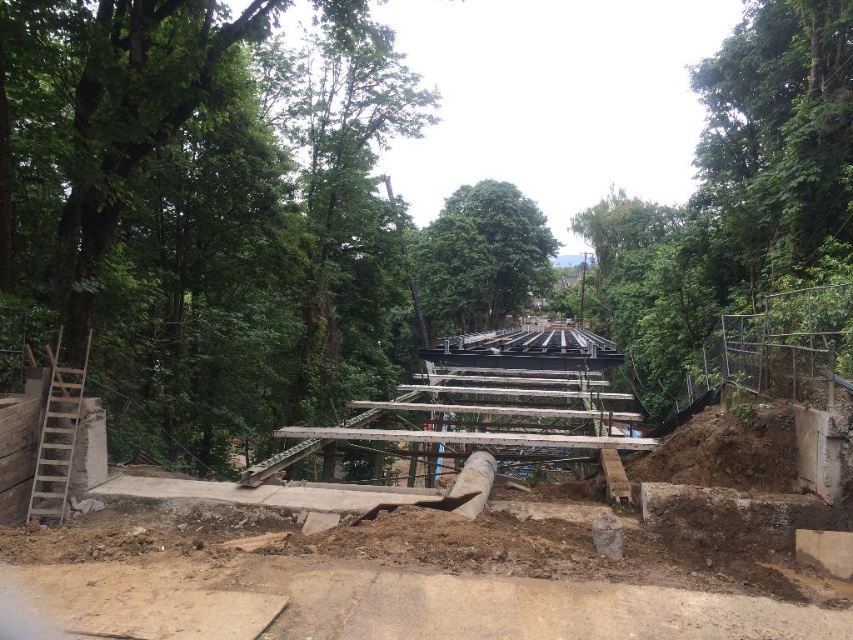
Is brown dirt track at lower left positioned in front of green leafy tree at upper right?

Yes, brown dirt track at lower left is in front of green leafy tree at upper right.

This screenshot has height=640, width=853. What do you see at coordinates (405, 582) in the screenshot? I see `brown dirt track at lower left` at bounding box center [405, 582].

Find the location of a particular element. This screenshot has height=640, width=853. brown dirt track at lower left is located at coordinates (405, 582).

Can you confirm if concrete stairs at center is positioned to the left of green leafy tree at upper right?

Correct, you'll find concrete stairs at center to the left of green leafy tree at upper right.

Is point (604, 358) positioned in front of point (792, 48)?

That is False.

Describe the element at coordinates (526, 609) in the screenshot. The height and width of the screenshot is (640, 853). I see `concrete stairs at center` at that location.

The height and width of the screenshot is (640, 853). What are the coordinates of `concrete stairs at center` in the screenshot? It's located at (526, 609).

Is brown dirt track at lower left further to the viewer compared to green leafy tree at center?

No.

Which is above, brown dirt track at lower left or green leafy tree at center?

Positioned higher is green leafy tree at center.

Describe the element at coordinates (405, 582) in the screenshot. This screenshot has height=640, width=853. I see `brown dirt track at lower left` at that location.

Where is `brown dirt track at lower left`? The image size is (853, 640). brown dirt track at lower left is located at coordinates (405, 582).